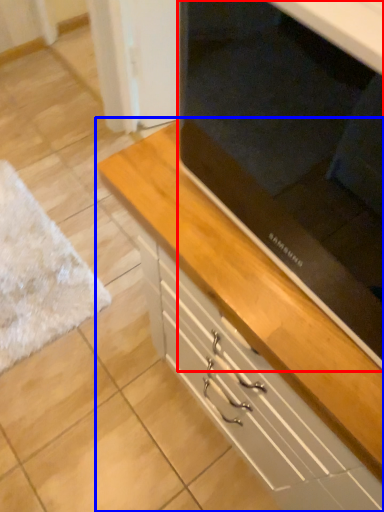
Question: Which object is closer to the camera taking this photo, appliance (highlighted by a red box) or chest of drawers (highlighted by a blue box)?

Choices:
 (A) appliance
 (B) chest of drawers

Answer: (A)